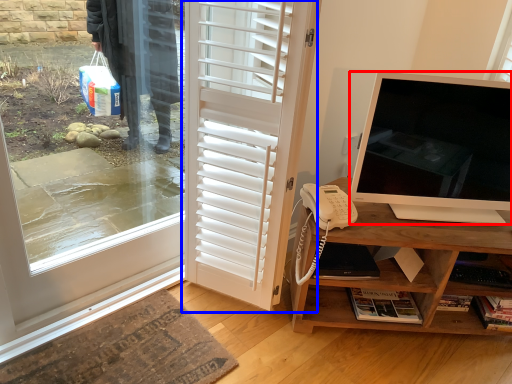
Question: Which object appears closest to the camera in this image, television (highlighted by a red box) or door (highlighted by a blue box)?

Choices:
 (A) television
 (B) door

Answer: (B)